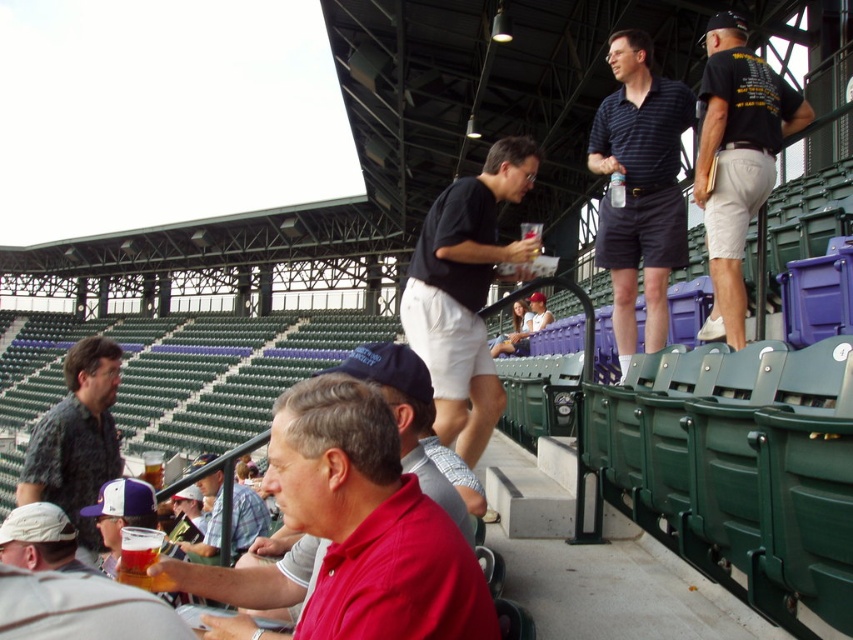
Question: Which object appears farthest from the camera in this image?

Choices:
 (A) dark green textured shirt at left
 (B) red cotton shirt at center
 (C) black cotton shirt at center
 (D) striped polo shirt at upper right

Answer: (D)

Question: Is striped polo shirt at upper right to the left of white fabric cap at lower left from the viewer's perspective?

Choices:
 (A) yes
 (B) no

Answer: (B)

Question: Is red cotton shirt at center further to the viewer compared to plaid shirt at lower center?

Choices:
 (A) no
 (B) yes

Answer: (A)

Question: Can you confirm if black cotton shirt at upper right is positioned below white fabric cap at lower left?

Choices:
 (A) no
 (B) yes

Answer: (A)

Question: Based on their relative distances, which object is farther from the red cotton shirt at center?

Choices:
 (A) white fabric cap at lower left
 (B) striped polo shirt at upper right
 (C) matte black shirt at center
 (D) black cotton shirt at upper right

Answer: (C)

Question: Among these objects, which one is nearest to the camera?

Choices:
 (A) black cotton shirt at upper right
 (B) red cotton shirt at center
 (C) striped polo shirt at upper right

Answer: (B)